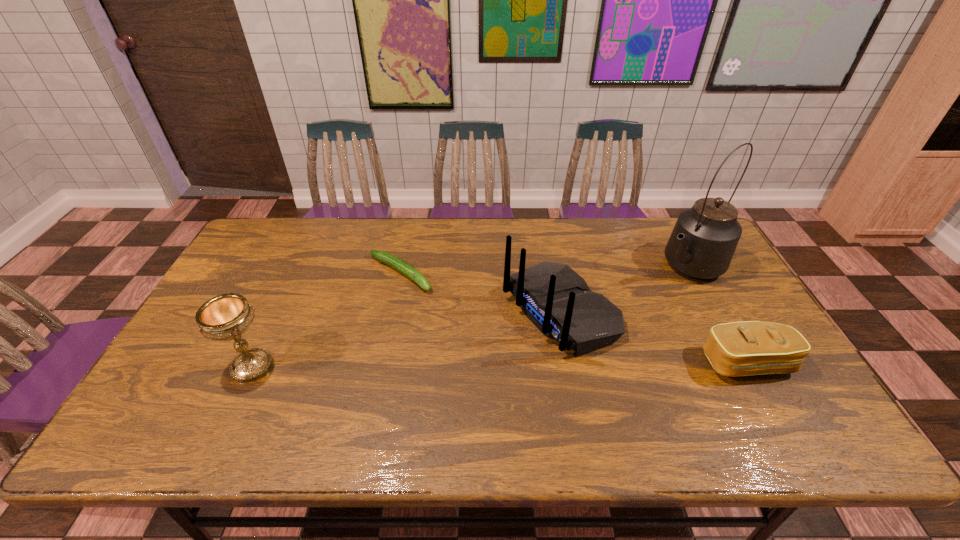
Identify the location of object identified as the second closest to the kettle. Image resolution: width=960 pixels, height=540 pixels. (746, 348).

The height and width of the screenshot is (540, 960). In order to click on object that is the second closest to the fourth tallest object in this screenshot , I will do `click(704, 239)`.

Where is `free space that satisfies the following two spatial constraints: 1. on the front side of the fourth object from right to left; 2. on the left side of the router`? This screenshot has height=540, width=960. free space that satisfies the following two spatial constraints: 1. on the front side of the fourth object from right to left; 2. on the left side of the router is located at coordinates (393, 311).

The height and width of the screenshot is (540, 960). In order to click on vacant region that satisfies the following two spatial constraints: 1. on the back side of the chalice; 2. on the left side of the tallest object in this screenshot , I will do `click(299, 266)`.

Image resolution: width=960 pixels, height=540 pixels. Find the location of `vacant space that satisfies the following two spatial constraints: 1. on the back side of the third object from right to left; 2. on the left side of the kettle`. vacant space that satisfies the following two spatial constraints: 1. on the back side of the third object from right to left; 2. on the left side of the kettle is located at coordinates (551, 266).